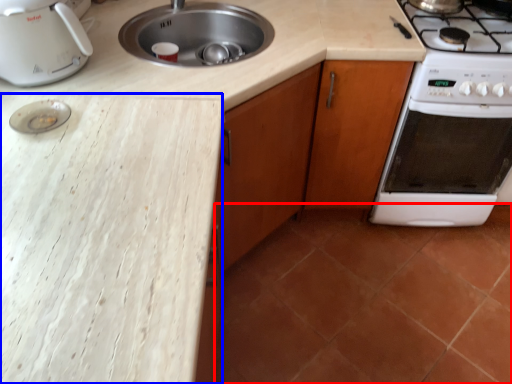
Question: Among these objects, which one is nearest to the camera, tile (highlighted by a red box) or counter top (highlighted by a blue box)?

Choices:
 (A) tile
 (B) counter top

Answer: (B)